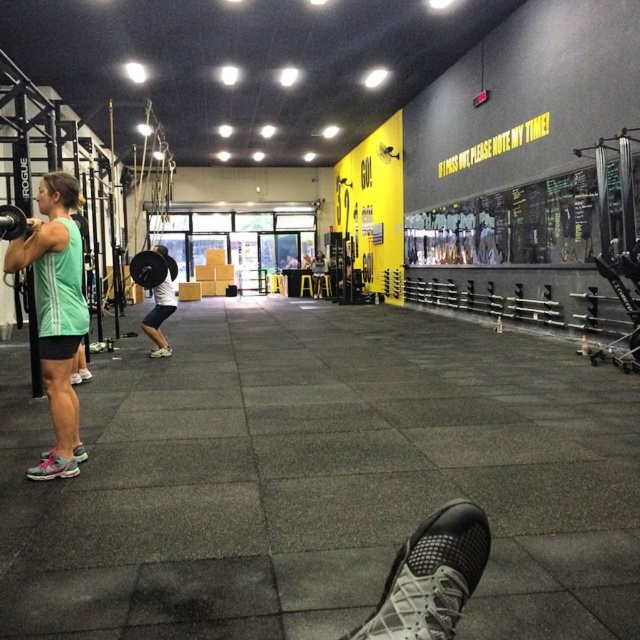
Question: Can you confirm if green matte tank top at center is positioned below black rubber barbell at center?

Choices:
 (A) no
 (B) yes

Answer: (B)

Question: Is green matte tank top at center behind black rubber barbell at center?

Choices:
 (A) yes
 (B) no

Answer: (B)

Question: Estimate the real-world distances between objects in this image. Which object is farther from the white mesh shoe at lower center?

Choices:
 (A) black rubber barbell at center
 (B) pink mesh shoe at lower left
 (C) green matte tank top at center

Answer: (A)

Question: Which of the following is the closest to the observer?

Choices:
 (A) pink mesh shoe at lower left
 (B) green matte tank top at center

Answer: (B)

Question: Is matte black barbell at center below pink mesh shoe at lower left?

Choices:
 (A) no
 (B) yes

Answer: (A)

Question: Which is nearer to the green matte tank top at center?

Choices:
 (A) white mesh shoe at lower center
 (B) matte black barbell at center

Answer: (A)